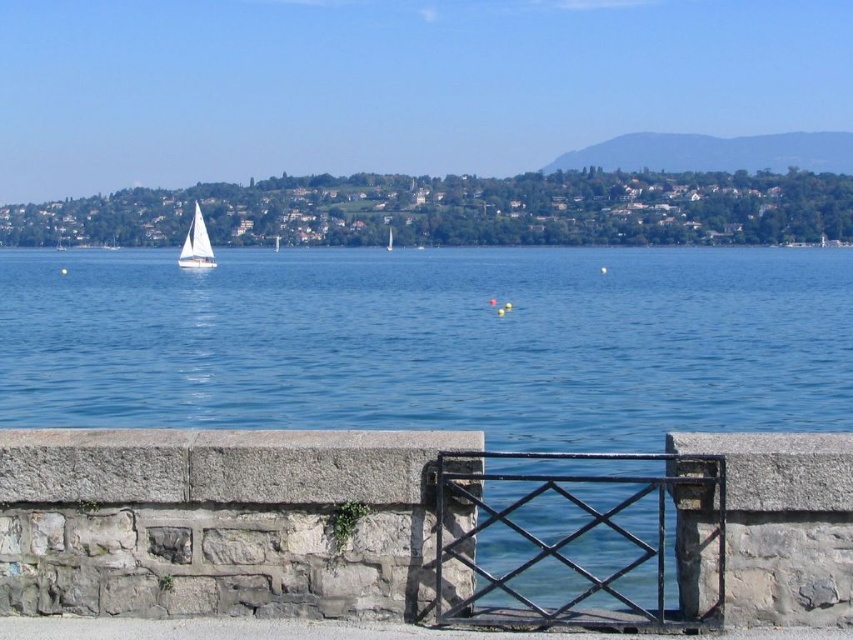
Question: Is white sailboat at left positioned before white matte sailboat at center?

Choices:
 (A) no
 (B) yes

Answer: (B)

Question: Which object is positioned closest to the blue water at center?

Choices:
 (A) white sailboat at left
 (B) black wrought iron gate at center
 (C) white matte sailboat at center

Answer: (A)

Question: Among these points, which one is nearest to the camera?

Choices:
 (A) (463, 317)
 (B) (387, 228)
 (C) (206, 268)
 (D) (556, 548)

Answer: (D)

Question: Is blue water at center below black wrought iron gate at center?

Choices:
 (A) yes
 (B) no

Answer: (B)

Question: Among these points, which one is farthest from the camera?

Choices:
 (A) (698, 481)
 (B) (206, 237)

Answer: (B)

Question: Is white sailboat at left thinner than white matte sailboat at center?

Choices:
 (A) yes
 (B) no

Answer: (B)